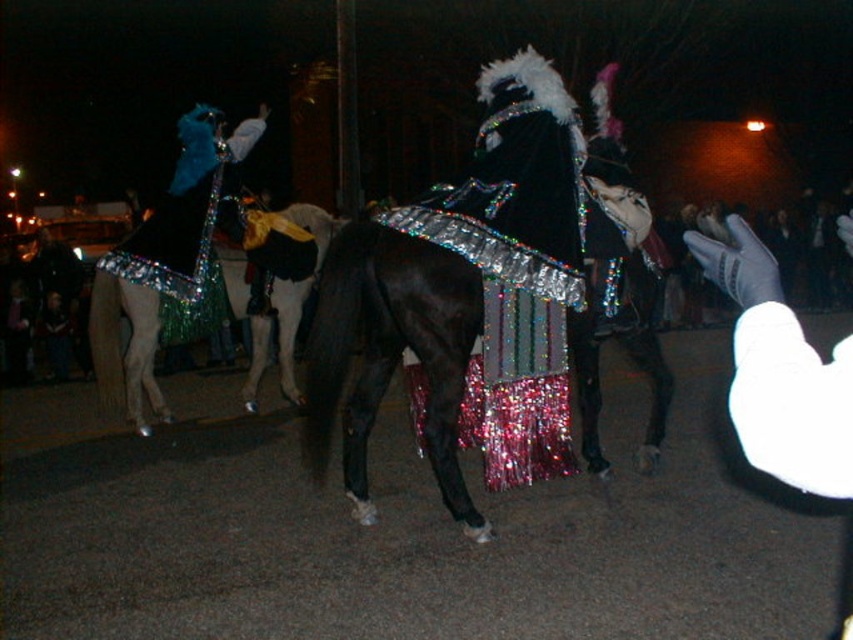
You are a photographer trying to capture the entire scene of the holographic sequined cape at center and the shiny metallic horse at center in one shot. Based on their sizes, which object should you focus on first to ensure both are in frame?

The holographic sequined cape at center is taller than the shiny metallic horse at center, so you should focus on the taller object first to ensure both fit in the frame.

You are a photographer trying to capture the festive parade scene. You notice the holographic sequined cape at center and the shiny metallic horse at center. Which object should you focus on first if you want to photograph the one that is located more to the left?

The holographic sequined cape at center is positioned on the left side of shiny metallic horse at center, so you should focus on the holographic sequined cape at center first since it is more to the left.